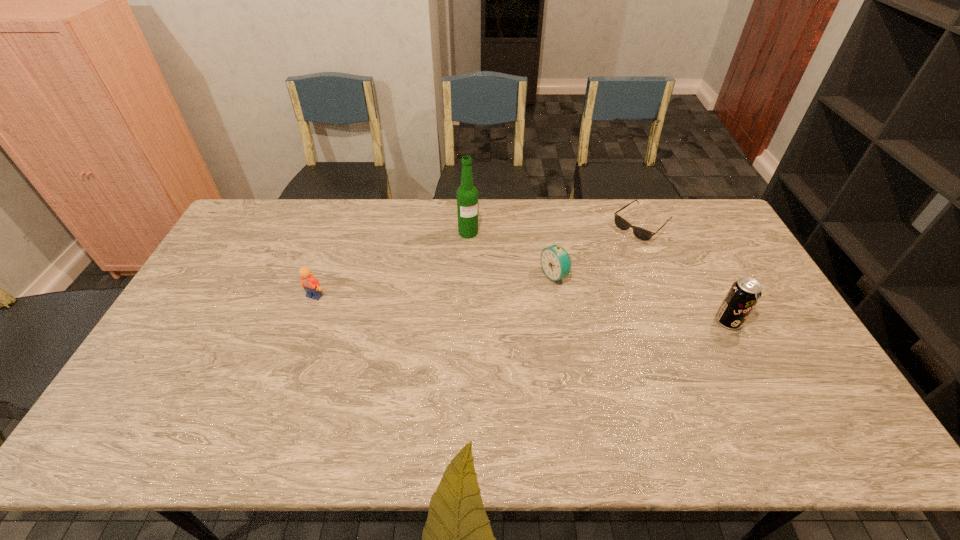
At what (x,y) coordinates should I click in order to perform the action: click on the second nearest object. Please return your answer as a coordinate pair (x, y). The height and width of the screenshot is (540, 960). Looking at the image, I should click on (312, 286).

Image resolution: width=960 pixels, height=540 pixels. I want to click on the leftmost object, so click(312, 286).

This screenshot has height=540, width=960. Identify the location of soda can. (744, 294).

Find the location of a particular element. The image size is (960, 540). the fourth shortest object is located at coordinates (744, 294).

The width and height of the screenshot is (960, 540). Identify the location of the third object from right to left. 555,261.

Image resolution: width=960 pixels, height=540 pixels. What are the coordinates of `alarm clock` in the screenshot? It's located at (555, 261).

The width and height of the screenshot is (960, 540). Find the location of `the second object from left to right`. the second object from left to right is located at coordinates (467, 194).

At what (x,y) coordinates should I click in order to perform the action: click on the tallest object. Please return your answer as a coordinate pair (x, y). The height and width of the screenshot is (540, 960). Looking at the image, I should click on (467, 194).

This screenshot has height=540, width=960. Identify the location of the shortest object. (642, 234).

The width and height of the screenshot is (960, 540). Find the location of `vacant space positioned on the front-facing side of the fourth farthest object`. vacant space positioned on the front-facing side of the fourth farthest object is located at coordinates (303, 327).